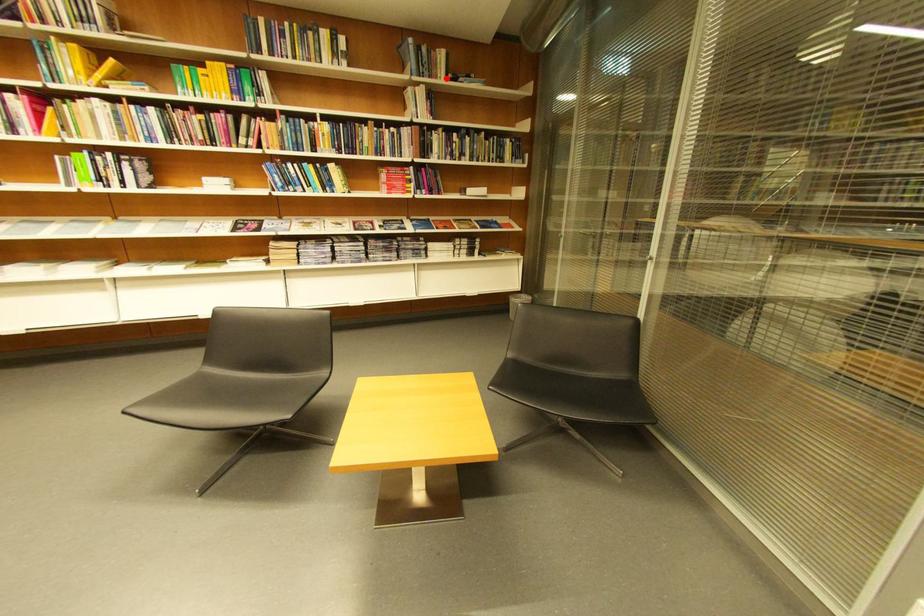
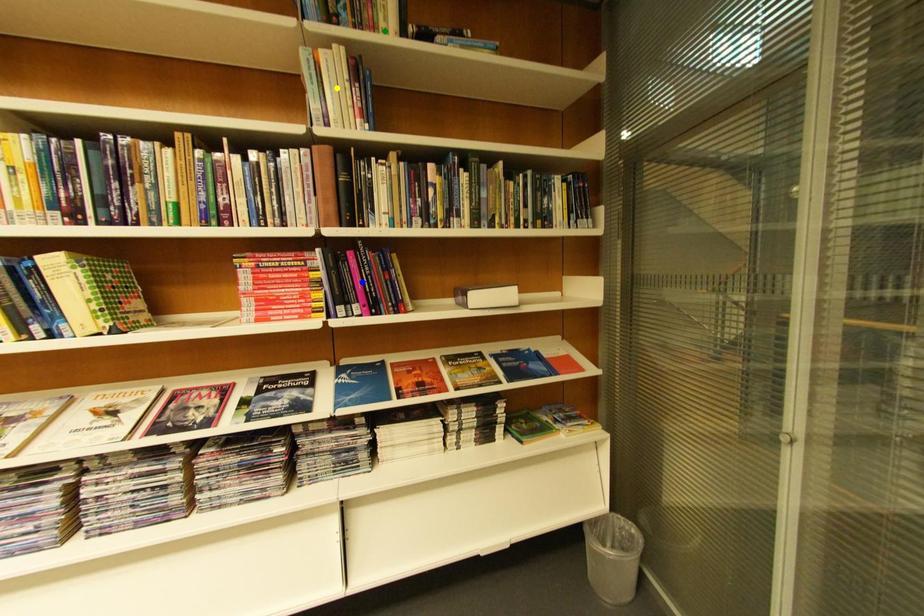
Question: I am providing you with two images of the same scene from different viewpoints. A red point is marked on the first image. You are given multiple points on the second image. Can you choose the point in image 2 that corresponds to the point in image 1?

Choices:
 (A) green point
 (B) blue point
 (C) yellow point

Answer: (A)